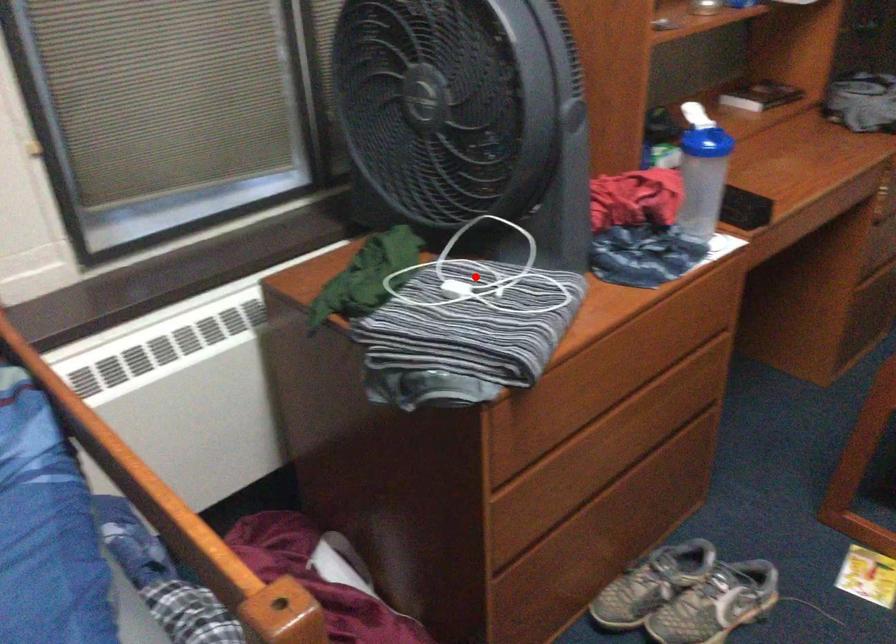
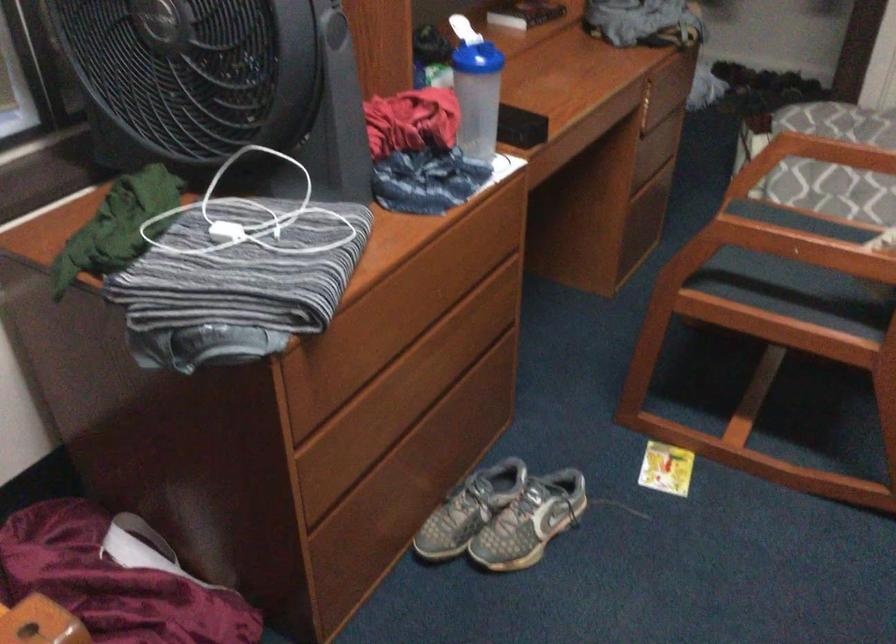
Find the pixel in the second image that matches the highlighted location in the first image.

(250, 216)